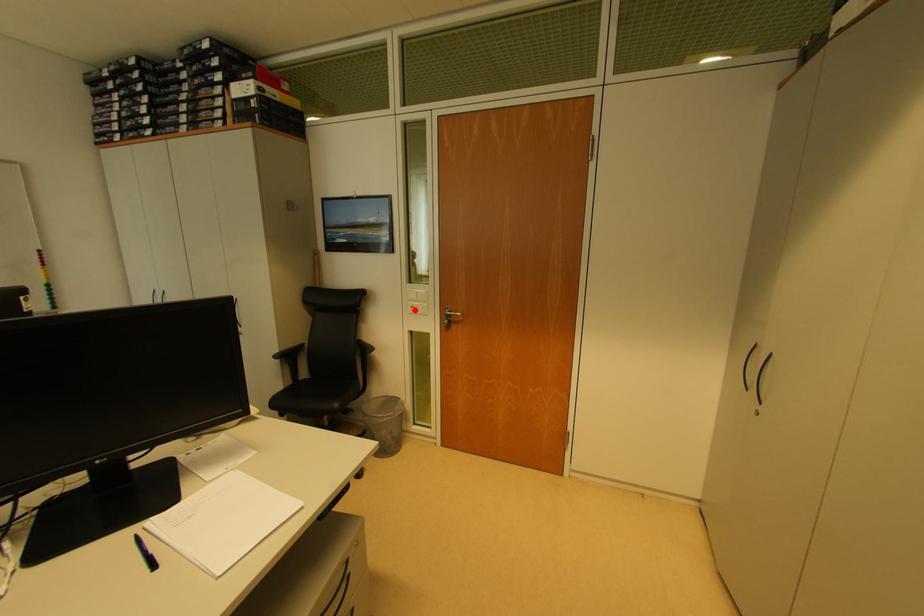
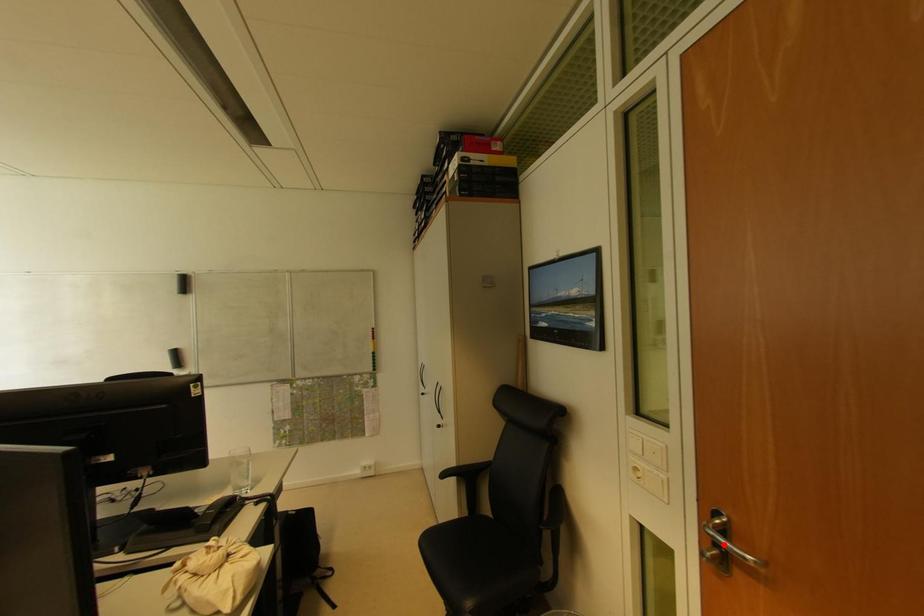
I am providing you with two images of the same scene from different viewpoints. A red point is marked on the first image and another point is marked on the second image. Is the red point in image1 aligned with the point shown in image2?

No